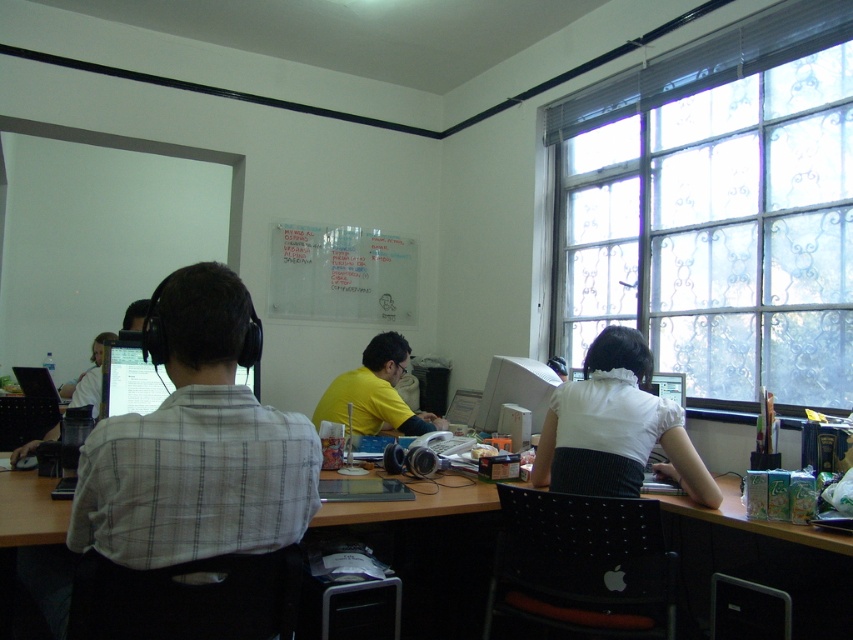
What is the color of the shirt worn by the person at the point with coordinates [196,444]?

The white checkered shirt at left is located at point [196,444].

You are a photographer setting up a shoot in this office scene. You notice two shirts hanging on a chair in the background. The white checkered shirt at left and the yellow matte shirt at center. Which shirt is taller?

The white checkered shirt at left is taller than the yellow matte shirt at center.

You are setting up a dual monitor workstation using the matte black monitor at left and the white glossy monitor at center. Which monitor should you place closer to you to ensure both monitors are aligned horizontally?

The matte black monitor at left has a smaller size compared to the white glossy monitor at center, so to align them horizontally, you should place the smaller matte black monitor at left closer to you so that both monitors appear aligned when viewed from your position.